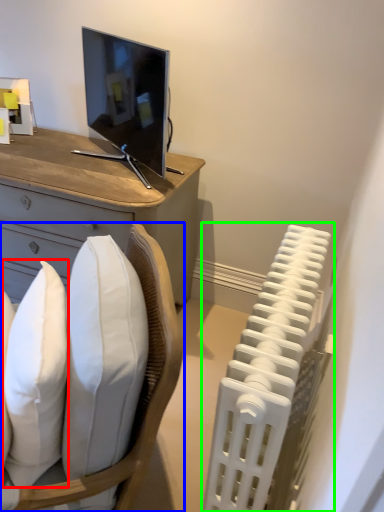
Question: Estimate the real-world distances between objects in this image. Which object is farther from pillow (highlighted by a red box), chair (highlighted by a blue box) or radiator (highlighted by a green box)?

Choices:
 (A) chair
 (B) radiator

Answer: (B)